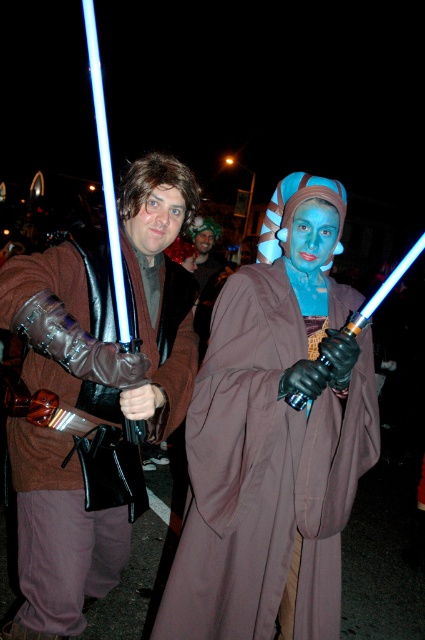
You are a costume designer trying to determine if the shiny silver lightsaber at center can be safely stored in a display case designed for the matte brown robe at center. Based on their sizes, will the lightsaber fit inside the robe display case?

The shiny silver lightsaber at center has a width larger than the matte brown robe at center, so it will not fit inside the robe display case designed for the robe.

You are a photographer at a costume event. You need to capture a clear photo of both the blue matte face at center and the smooth skin face at center. Which face should you focus on first to ensure it is in sharp focus?

→ The blue matte face at center is closer to the viewer than the smooth skin face at center, so you should focus on the blue matte face at center first to ensure it is in sharp focus.